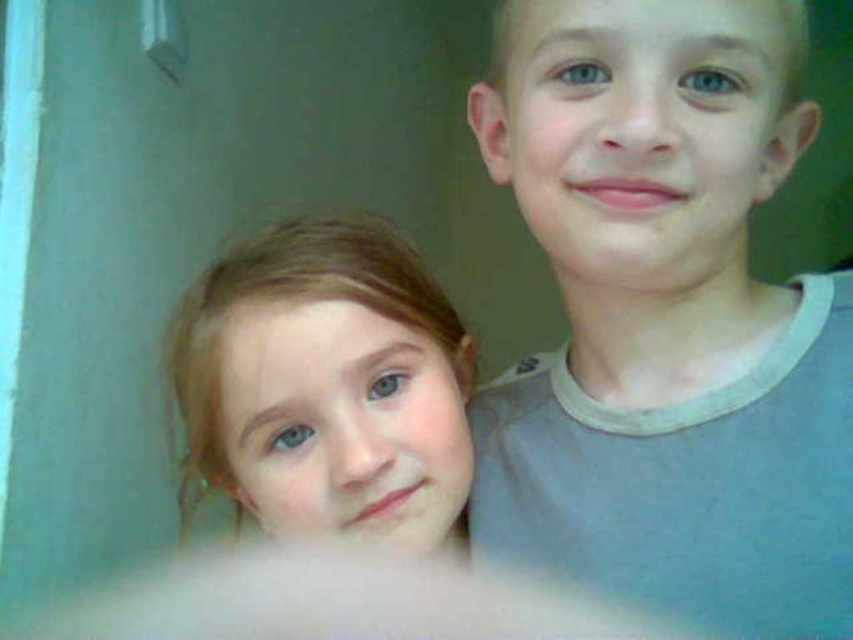
From the picture: Who is more forward, (718, 1) or (282, 333)?

Point (718, 1) is more forward.

Can you confirm if gray cotton shirt at right is shorter than smooth blonde hair at lower left?

No.

The height and width of the screenshot is (640, 853). Identify the location of gray cotton shirt at right. click(666, 320).